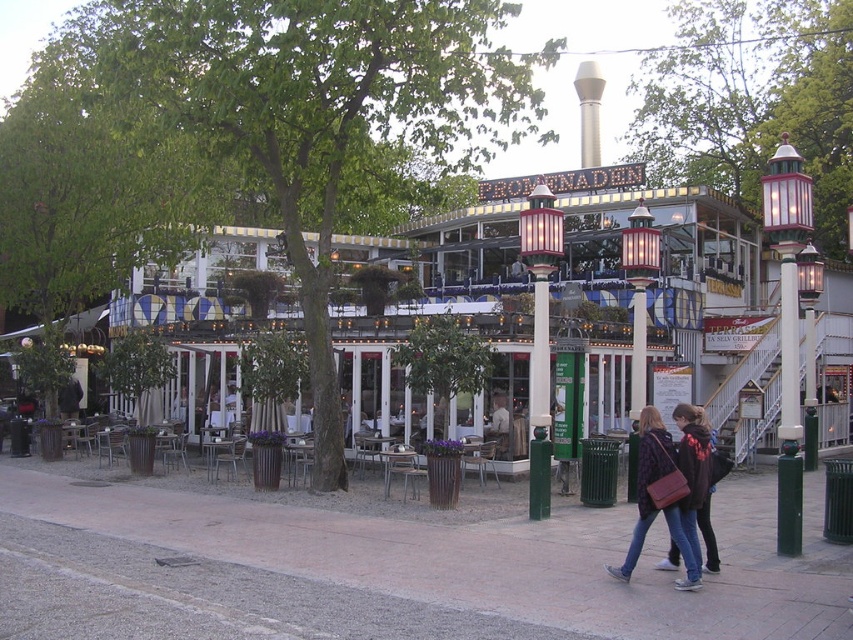
Question: Is green painted metal lamp post at right positioned at the back of matte red lamp post at center?

Choices:
 (A) no
 (B) yes

Answer: (A)

Question: Estimate the real-world distances between objects in this image. Which object is closer to the matte black jacket at lower center?

Choices:
 (A) green painted metal lamp post at right
 (B) metallic glass lamp post at center

Answer: (A)

Question: Which point appears farthest from the camera in this image?

Choices:
 (A) (786, 401)
 (B) (630, 280)

Answer: (B)

Question: Does green painted metal lamp post at right have a lesser width compared to matte black jacket at lower center?

Choices:
 (A) yes
 (B) no

Answer: (B)

Question: Can you confirm if green painted metal lamp post at right is positioned to the right of matte black jacket at lower center?

Choices:
 (A) no
 (B) yes

Answer: (B)

Question: Among these points, which one is farthest from the camera?

Choices:
 (A) (672, 516)
 (B) (508, 435)
 (C) (44, 589)

Answer: (B)